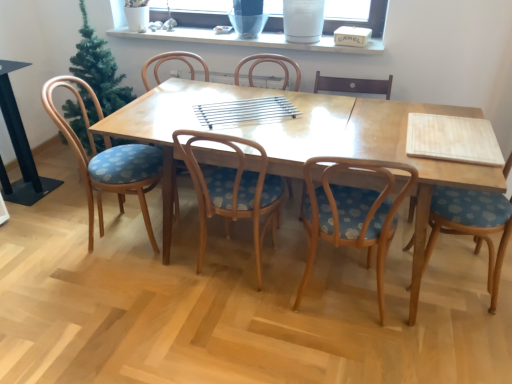
Question: Is wooden chair with blue floral cushion at left, acting as the first chair starting from the left, positioned with its back to wooden chair with blue patterned seat at center, the 5th chair in the right-to-left sequence?

Choices:
 (A) yes
 (B) no

Answer: (B)

Question: From the image's perspective, is wooden chair with blue floral cushion at left, acting as the first chair starting from the left, below wooden chair with blue patterned seat at center, which is the second chair in left-to-right order?

Choices:
 (A) yes
 (B) no

Answer: (A)

Question: Is wooden chair with blue patterned seat at center, which is the second chair in left-to-right order, located within wooden chair with blue floral cushion at left, acting as the sixth chair starting from the right?

Choices:
 (A) no
 (B) yes

Answer: (A)

Question: Is wooden chair with blue floral cushion at left, acting as the sixth chair starting from the right, bigger than wooden chair with blue patterned seat at center, the 5th chair in the right-to-left sequence?

Choices:
 (A) no
 (B) yes

Answer: (B)

Question: Is wooden chair with blue floral cushion at left, acting as the first chair starting from the left, to the left of wooden chair with blue patterned seat at center, the 5th chair in the right-to-left sequence, from the viewer's perspective?

Choices:
 (A) yes
 (B) no

Answer: (A)

Question: Is white ceramic vase at upper center wider or thinner than transparent glass window screen at upper center?

Choices:
 (A) thin
 (B) wide

Answer: (B)

Question: Looking at the image, does white ceramic vase at upper center seem bigger or smaller compared to transparent glass window screen at upper center?

Choices:
 (A) big
 (B) small

Answer: (B)

Question: From the image's perspective, is white ceramic vase at upper center positioned above or below transparent glass window screen at upper center?

Choices:
 (A) below
 (B) above

Answer: (A)

Question: Would you say white ceramic vase at upper center is inside or outside transparent glass window screen at upper center?

Choices:
 (A) inside
 (B) outside

Answer: (B)

Question: Choose the correct answer: Is wooden chair with blue cushion at center, marked as the third chair in a left-to-right arrangement, inside transparent glass window screen at upper center or outside it?

Choices:
 (A) outside
 (B) inside

Answer: (A)

Question: From a real-world perspective, is wooden chair with blue cushion at center, which is counted as the 4th chair, starting from the right, positioned above or below transparent glass window screen at upper center?

Choices:
 (A) above
 (B) below

Answer: (B)

Question: Is wooden chair with blue cushion at center, marked as the third chair in a left-to-right arrangement, in front of or behind transparent glass window screen at upper center in the image?

Choices:
 (A) front
 (B) behind

Answer: (A)

Question: Is point (224, 140) positioned closer to the camera than point (208, 21)?

Choices:
 (A) closer
 (B) farther

Answer: (A)

Question: From a real-world perspective, relative to transparent glass window screen at upper center, is blue fabric chair at right, the first chair positioned from the right, vertically above or below?

Choices:
 (A) above
 (B) below

Answer: (B)

Question: Would you say blue fabric chair at right, the 6th chair in the left-to-right sequence, is inside or outside transparent glass window screen at upper center?

Choices:
 (A) outside
 (B) inside

Answer: (A)